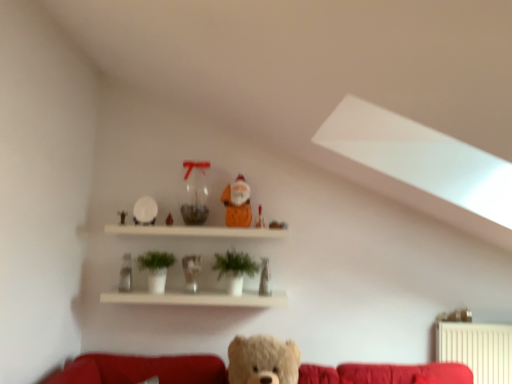
Where is `matte orange santa at upper center, the 5th toy viewed from the left`? matte orange santa at upper center, the 5th toy viewed from the left is located at coordinates (277, 225).

This screenshot has width=512, height=384. What do you see at coordinates (277, 225) in the screenshot?
I see `matte orange santa at upper center, the 5th toy viewed from the left` at bounding box center [277, 225].

Locate an element on the screen. This screenshot has height=384, width=512. clear glass vase at center, the 5th toy when ordered from right to left is located at coordinates (126, 274).

Measure the distance between point (121, 266) and camera.

The distance of point (121, 266) from camera is 2.78 meters.

Find the location of a particular element. The image size is (512, 384). white glossy shelf at upper center is located at coordinates (198, 297).

The height and width of the screenshot is (384, 512). Describe the element at coordinates (198, 297) in the screenshot. I see `white glossy shelf at upper center` at that location.

From the picture: How much space does matte glass vase at upper center, placed as the second toy when sorted from left to right, occupy vertically?

4.22 inches.

Image resolution: width=512 pixels, height=384 pixels. What do you see at coordinates (194, 193) in the screenshot?
I see `transparent glass vase at center` at bounding box center [194, 193].

Measure the distance between point (230, 219) and camera.

2.63 meters.

You are a GUI agent. You are given a task and a screenshot of the screen. Output one action in this format:
    pyautogui.click(x=<x>, y=<y>)
    Task: Click on the matte glass vase at upper center, the 1th figurine positioned from the right
    The width and height of the screenshot is (512, 384).
    Given the screenshot: What is the action you would take?
    click(x=264, y=278)

Image resolution: width=512 pixels, height=384 pixels. What are the coordinates of `matte orange santa at upper center, the 1th toy viewed from the right` in the screenshot? It's located at (277, 225).

Is green matte plant at center looking in the opposite direction of translucent glass figurine at center, the second figurine from the right?

That's not correct — green matte plant at center is not looking away from translucent glass figurine at center, the second figurine from the right.

Locate an element on the screen. The width and height of the screenshot is (512, 384). plant in front of the translucent glass figurine at center, the second figurine from the right is located at coordinates (234, 264).

Relative to translucent glass figurine at center, which ranks as the first figurine in left-to-right order, is green matte plant at center in front or behind?

Visually, green matte plant at center is located in front of translucent glass figurine at center, which ranks as the first figurine in left-to-right order.

Looking at this image, considering the sizes of objects green matte plant at center and translucent glass figurine at center, the second figurine from the right, in the image provided, who is shorter, green matte plant at center or translucent glass figurine at center, the second figurine from the right,?

Standing shorter between the two is translucent glass figurine at center, the second figurine from the right.

How many degrees apart are the facing directions of translucent glass figurine at center, the second figurine from the right, and transparent glass vase at center?

They differ by 0.00808 degrees in their facing directions.

Is translucent glass figurine at center, which ranks as the first figurine in left-to-right order, looking in the opposite direction of transparent glass vase at center?

That's not correct — translucent glass figurine at center, which ranks as the first figurine in left-to-right order, is not looking away from transparent glass vase at center.

Is translucent glass figurine at center, which ranks as the first figurine in left-to-right order, beside transparent glass vase at center?

No, translucent glass figurine at center, which ranks as the first figurine in left-to-right order, is not next to transparent glass vase at center.

From a real-world perspective, is translucent glass figurine at center, the second figurine from the right, positioned above or below transparent glass vase at center?

translucent glass figurine at center, the second figurine from the right, is below transparent glass vase at center.

Is point (223, 292) behind point (189, 218)?

No.

Considering the relative positions of white glossy shelf at upper center and transparent glass vase at center in the image provided, is white glossy shelf at upper center to the left of transparent glass vase at center from the viewer's perspective?

No.

Is white glossy shelf at upper center inside or outside of transparent glass vase at center?

white glossy shelf at upper center lies outside transparent glass vase at center.

Choose the correct answer: Is clear glass vase at center, the 5th toy when ordered from right to left, inside matte orange santa at upper center, the third toy from the left, or outside it?

The correct answer is: outside.

From the image's perspective, which one is positioned higher, clear glass vase at center, the 5th toy when ordered from right to left, or matte orange santa at upper center, marked as the third toy in a right-to-left arrangement?

matte orange santa at upper center, marked as the third toy in a right-to-left arrangement, from the image's perspective.

Who is shorter, clear glass vase at center, which ranks as the first toy in left-to-right order, or matte orange santa at upper center, the third toy from the left?

clear glass vase at center, which ranks as the first toy in left-to-right order, is shorter.

Is clear glass vase at center, the 5th toy when ordered from right to left, positioned with its back to matte orange santa at upper center, the third toy from the left?

clear glass vase at center, the 5th toy when ordered from right to left, does not have its back to matte orange santa at upper center, the third toy from the left.

From the image's perspective, who appears lower, transparent glass vase at center or clear glass vase at center, the 5th toy when ordered from right to left?

clear glass vase at center, the 5th toy when ordered from right to left.

Could you tell me if transparent glass vase at center is turned towards clear glass vase at center, which ranks as the first toy in left-to-right order?

No, transparent glass vase at center is not oriented towards clear glass vase at center, which ranks as the first toy in left-to-right order.

Which object is positioned more to the left, transparent glass vase at center or clear glass vase at center, the 5th toy when ordered from right to left?

clear glass vase at center, the 5th toy when ordered from right to left, is more to the left.

Which figurine is the 2nd one when counting from the left side of the matte orange santa at upper center, the 1th toy viewed from the right? Please provide its 2D coordinates.

[(191, 271)]

In terms of width, does matte orange santa at upper center, the 5th toy viewed from the left, look wider or thinner when compared to translucent glass figurine at center, which ranks as the first figurine in left-to-right order?

In the image, matte orange santa at upper center, the 5th toy viewed from the left, appears to be more narrow than translucent glass figurine at center, which ranks as the first figurine in left-to-right order.

From the image's perspective, is matte orange santa at upper center, the 5th toy viewed from the left, over translucent glass figurine at center, which ranks as the first figurine in left-to-right order?

Correct, matte orange santa at upper center, the 5th toy viewed from the left, appears higher than translucent glass figurine at center, which ranks as the first figurine in left-to-right order, in the image.

Does matte orange santa at upper center, the 1th toy viewed from the right, turn towards translucent glass figurine at center, which ranks as the first figurine in left-to-right order?

No.

How far apart are matte orange santa at upper center, the 5th toy viewed from the left, and matte glass vase at upper center, the 1th figurine positioned from the right?

They are 11.53 inches apart.

Is point (283, 227) farther from camera compared to point (266, 276)?

That is True.

Locate an element on the screen. toy that is on the right side of matte glass vase at upper center, the 2th figurine from the left is located at coordinates (277, 225).

From a real-world perspective, does matte orange santa at upper center, the 1th toy viewed from the right, stand above matte glass vase at upper center, the 1th figurine positioned from the right?

Yes, from a real-world perspective, matte orange santa at upper center, the 1th toy viewed from the right, is over matte glass vase at upper center, the 1th figurine positioned from the right

Where is `plant on the right of translucent glass figurine at center, the second figurine from the right`? The image size is (512, 384). plant on the right of translucent glass figurine at center, the second figurine from the right is located at coordinates coord(234,264).

From a real-world perspective, count 2nd figurines downward from the transparent glass vase at center and point to it. Please provide its 2D coordinates.

[(191, 271)]

Based on their spatial positions, is transparent glass vase at center or clear glass vase at center, the 5th toy when ordered from right to left, closer to white glossy shelf at upper center?

transparent glass vase at center is closer to white glossy shelf at upper center.

Which object lies further to the anchor point matte orange santa at upper center, the third toy from the left, translucent glass figurine at center, which ranks as the first figurine in left-to-right order, or white glossy shelf at upper center?

Among the two, translucent glass figurine at center, which ranks as the first figurine in left-to-right order, is located further to matte orange santa at upper center, the third toy from the left.

Looking at the image, which one is located further to matte orange santa at upper center, the 1th toy viewed from the right, matte glass vase at upper center, the 4th toy when ordered from right to left, or green matte plant at center?

matte glass vase at upper center, the 4th toy when ordered from right to left, lies further to matte orange santa at upper center, the 1th toy viewed from the right, than the other object.

Looking at the image, which one is located further to white glossy shelf at upper center, matte orange santa at upper center, the third toy from the left, or matte orange santa at upper center, the 4th toy viewed from the left?

matte orange santa at upper center, the 4th toy viewed from the left, lies further to white glossy shelf at upper center than the other object.

Looking at the image, which one is located closer to transparent glass vase at center, matte glass vase at upper center, the 1th figurine positioned from the right, or matte glass vase at upper center, placed as the second toy when sorted from left to right?

matte glass vase at upper center, placed as the second toy when sorted from left to right.

From the image, which object appears to be nearer to matte orange santa at upper center, marked as the third toy in a right-to-left arrangement, clear glass vase at center, which ranks as the first toy in left-to-right order, or matte glass vase at upper center, placed as the second toy when sorted from left to right?

Among the two, matte glass vase at upper center, placed as the second toy when sorted from left to right, is located nearer to matte orange santa at upper center, marked as the third toy in a right-to-left arrangement.

Based on their spatial positions, is matte orange santa at upper center, marked as the third toy in a right-to-left arrangement, or matte glass vase at upper center, placed as the second toy when sorted from left to right, closer to matte glass vase at upper center, the 2th figurine from the left?

matte orange santa at upper center, marked as the third toy in a right-to-left arrangement.

Looking at the image, which one is located further to translucent glass figurine at center, the second figurine from the right, matte glass vase at upper center, the 2th figurine from the left, or matte orange santa at upper center, the 5th toy viewed from the left?

The object further to translucent glass figurine at center, the second figurine from the right, is matte orange santa at upper center, the 5th toy viewed from the left.

You are a GUI agent. You are given a task and a screenshot of the screen. Output one action in this format:
    pyautogui.click(x=<x>, y=<y>)
    Task: Click on the plant situated between white glossy shelf at upper center and matte orange santa at upper center, the 1th toy viewed from the right, from left to right
    The width and height of the screenshot is (512, 384).
    Given the screenshot: What is the action you would take?
    pyautogui.click(x=234, y=264)

Identify the location of plant between transparent glass vase at center and matte glass vase at upper center, the 1th figurine positioned from the right, in the up-down direction. (234, 264).

Where is `toy between clear glass vase at center, which ranks as the first toy in left-to-right order, and white glossy shelf at upper center, in the horizontal direction`? This screenshot has height=384, width=512. toy between clear glass vase at center, which ranks as the first toy in left-to-right order, and white glossy shelf at upper center, in the horizontal direction is located at coordinates (169, 220).

Find the location of `figurine between matte glass vase at upper center, placed as the second toy when sorted from left to right, and matte glass vase at upper center, the 2th figurine from the left, from left to right`. figurine between matte glass vase at upper center, placed as the second toy when sorted from left to right, and matte glass vase at upper center, the 2th figurine from the left, from left to right is located at coordinates (191, 271).